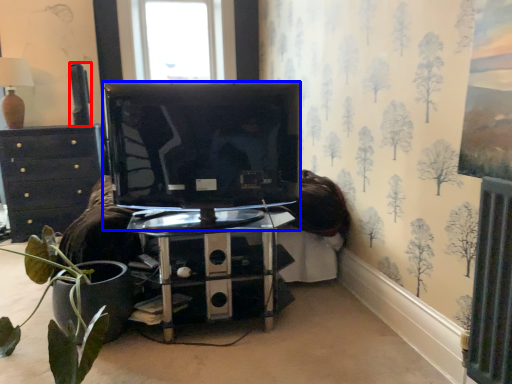
Question: Among these objects, which one is farthest to the camera, speaker (highlighted by a red box) or television (highlighted by a blue box)?

Choices:
 (A) speaker
 (B) television

Answer: (A)